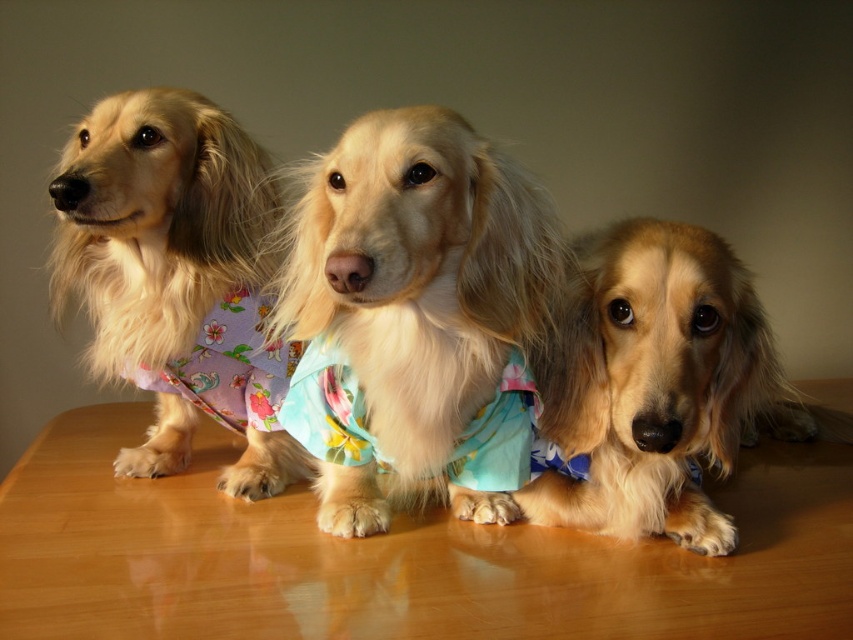
Question: Which object is closer to the camera taking this photo?

Choices:
 (A) fluffy light brown dog at left
 (B) wooden table at center
 (C) floral fabric dress at center
 (D) fluffy golden dog at center

Answer: (B)

Question: Which point is closer to the camera?

Choices:
 (A) (296, 445)
 (B) (233, 349)

Answer: (B)

Question: Is fluffy fabric dog at center above fluffy light brown dog at left?

Choices:
 (A) yes
 (B) no

Answer: (B)

Question: Observing the image, what is the correct spatial positioning of fluffy fabric dog at center in reference to fluffy golden dog at center?

Choices:
 (A) above
 (B) below

Answer: (A)

Question: Does fluffy fabric dog at center have a lesser width compared to floral fabric dress at center?

Choices:
 (A) yes
 (B) no

Answer: (A)

Question: Which point appears closest to the camera in this image?

Choices:
 (A) (386, 474)
 (B) (535, 394)

Answer: (B)